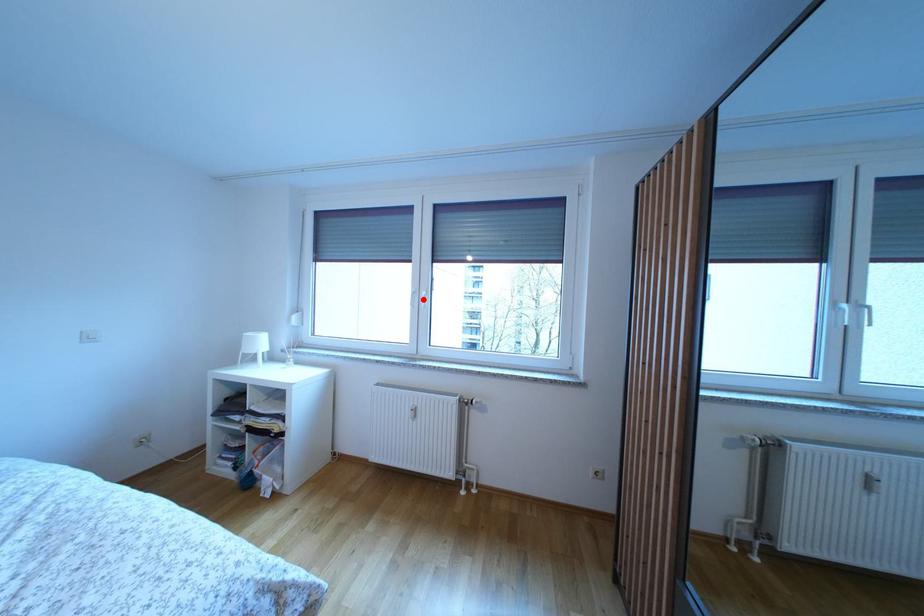
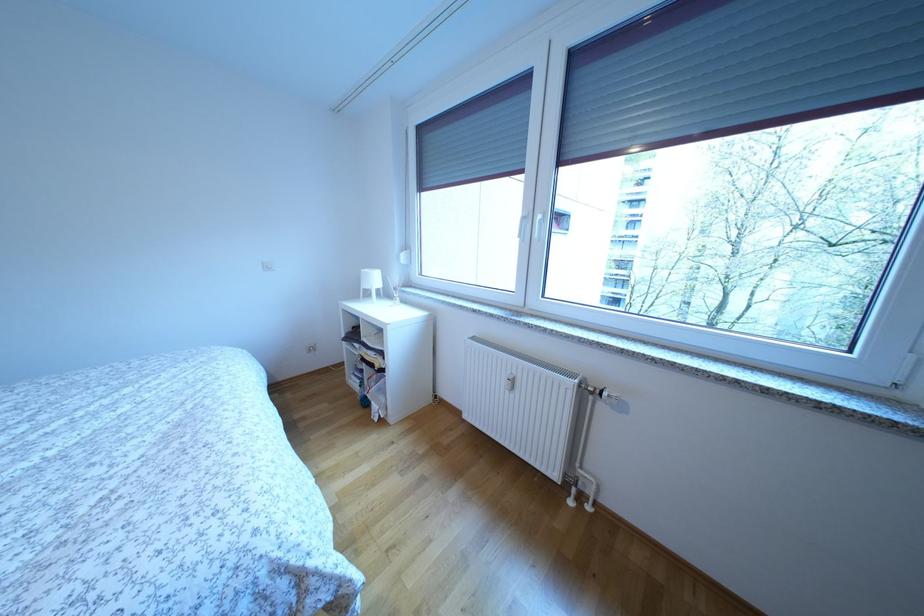
In the second image, find the point that corresponds to the highlighted location in the first image.

(535, 224)